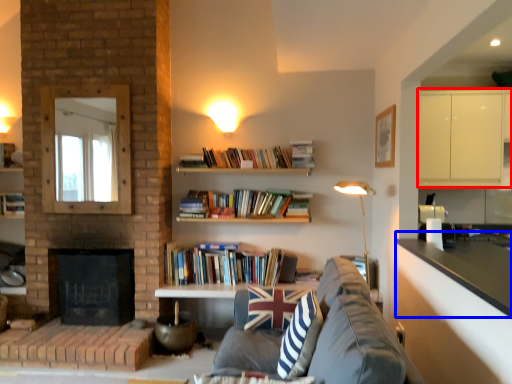
Question: Which object is further to the camera taking this photo, cabinetry (highlighted by a red box) or counter top (highlighted by a blue box)?

Choices:
 (A) cabinetry
 (B) counter top

Answer: (A)